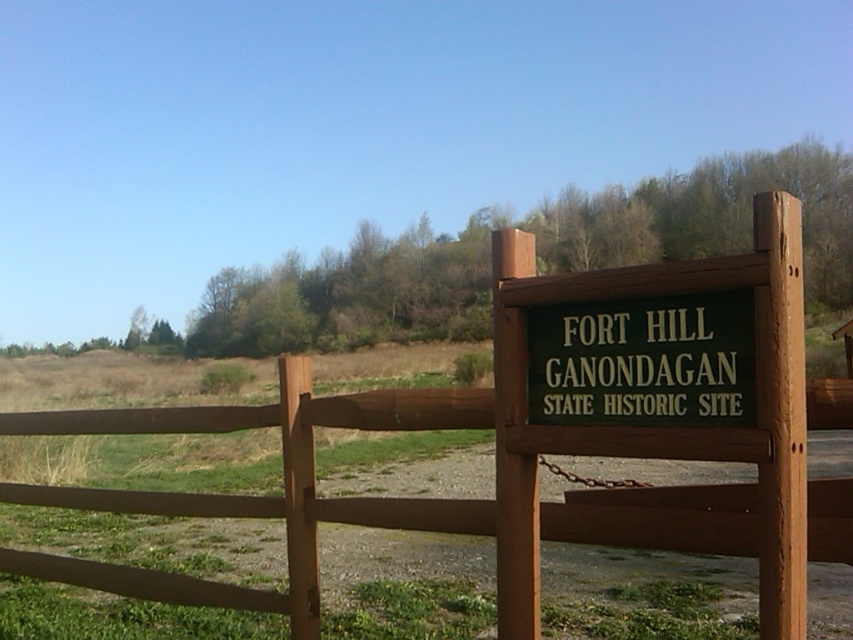
Can you confirm if brown wooden fence at center is positioned to the left of green painted wood sign at right?

Correct, you'll find brown wooden fence at center to the left of green painted wood sign at right.

Which of these two, brown wooden fence at center or green painted wood sign at right, stands shorter?

With less height is green painted wood sign at right.

This screenshot has height=640, width=853. Find the location of `brown wooden fence at center`. brown wooden fence at center is located at coordinates (519, 452).

This screenshot has height=640, width=853. What are the coordinates of `brown wooden fence at center` in the screenshot? It's located at (519, 452).